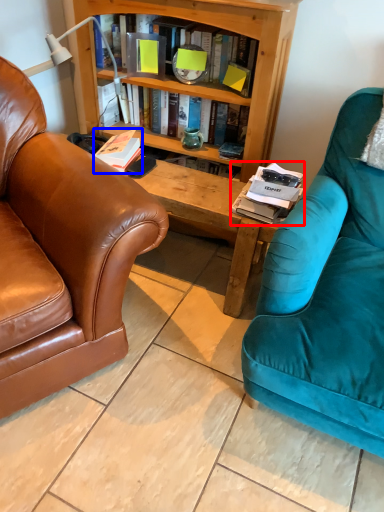
Question: Among these objects, which one is nearest to the camera, magazine (highlighted by a red box) or book (highlighted by a blue box)?

Choices:
 (A) magazine
 (B) book

Answer: (A)